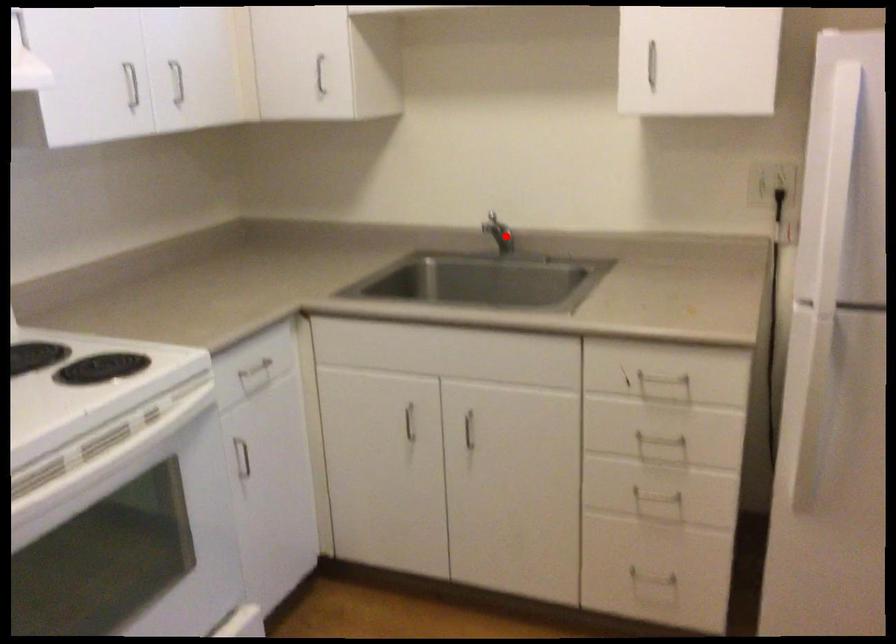
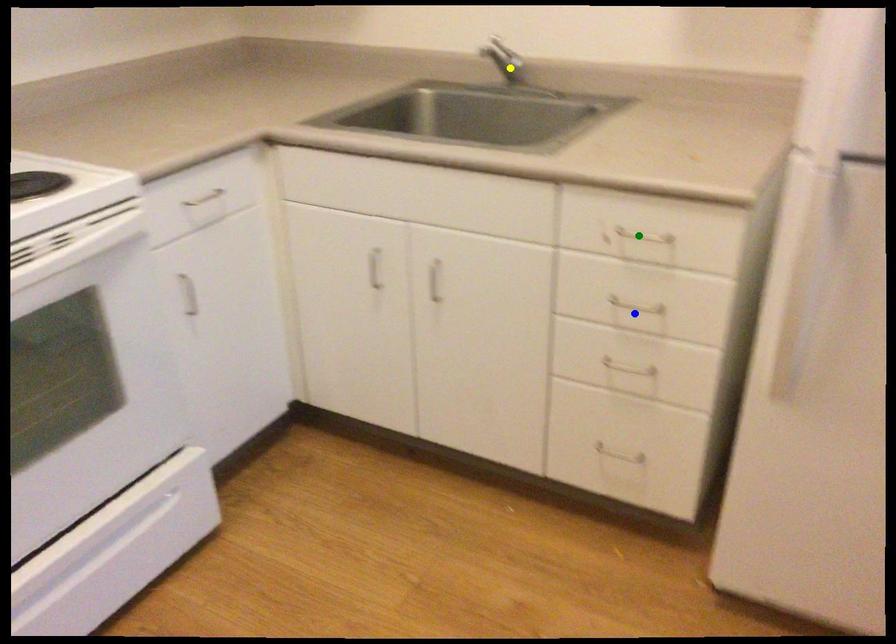
Question: I am providing you with two images of the same scene from different viewpoints. A red point is marked on the first image. You are given multiple points on the second image. Can you choose the point in image 2 that corresponds to the point in image 1?

Choices:
 (A) yellow point
 (B) blue point
 (C) green point

Answer: (A)